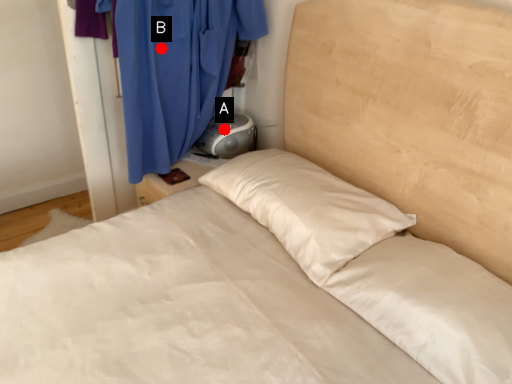
Question: Two points are circled on the image, labeled by A and B beside each circle. Which point appears closest to the camera in this image?

Choices:
 (A) A is closer
 (B) B is closer

Answer: (B)